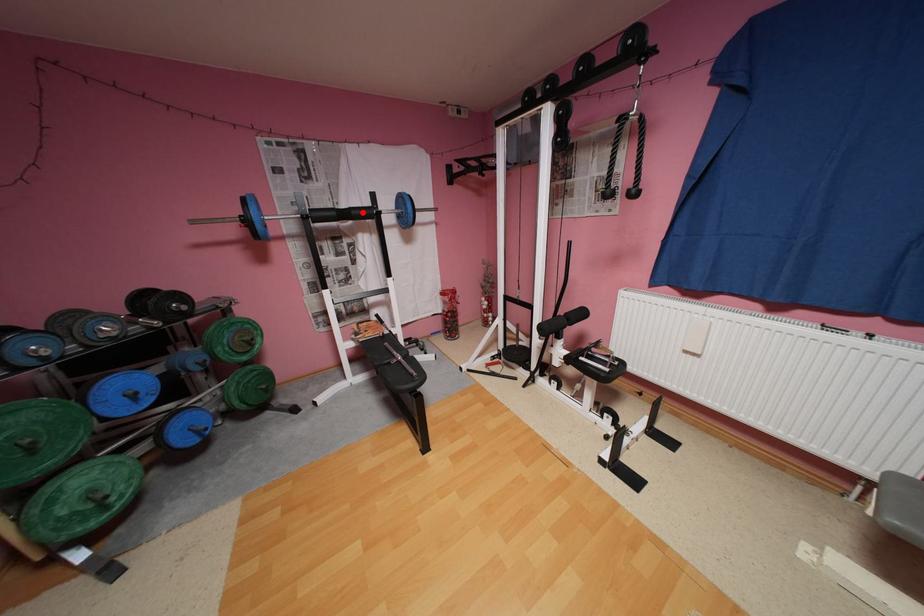
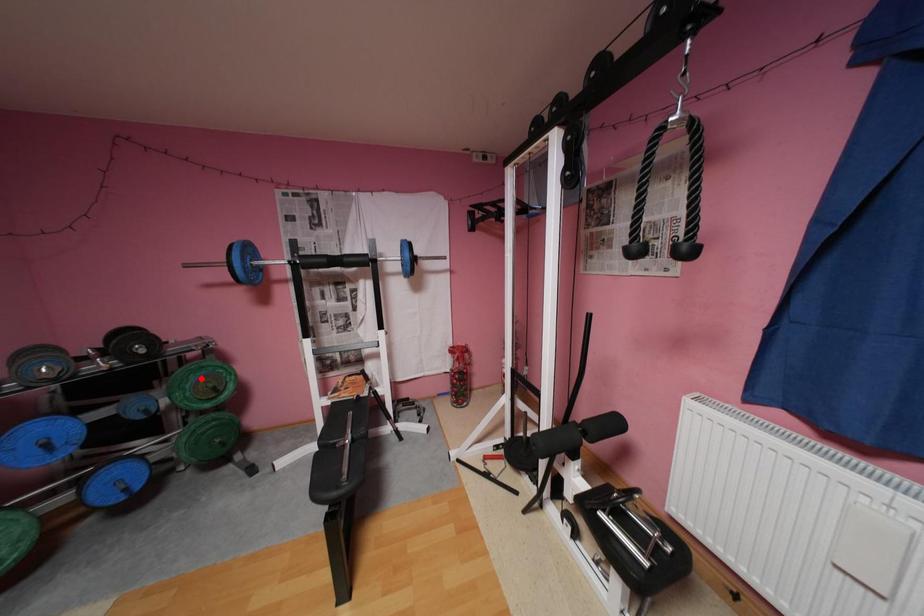
I am providing you with two images of the same scene from different viewpoints. A red point is marked on the first image and another point is marked on the second image. Do the highlighted points in image1 and image2 indicate the same real-world spot?

No